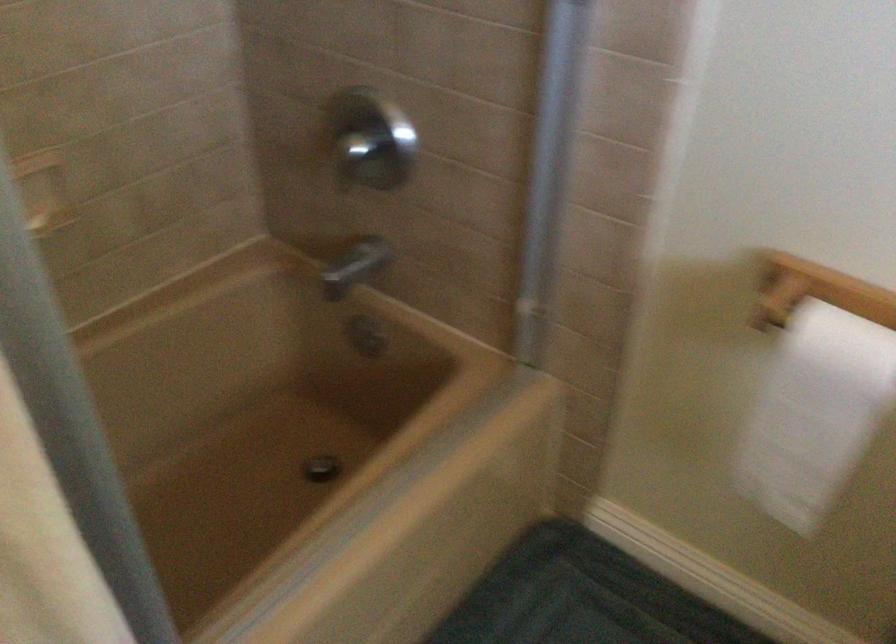
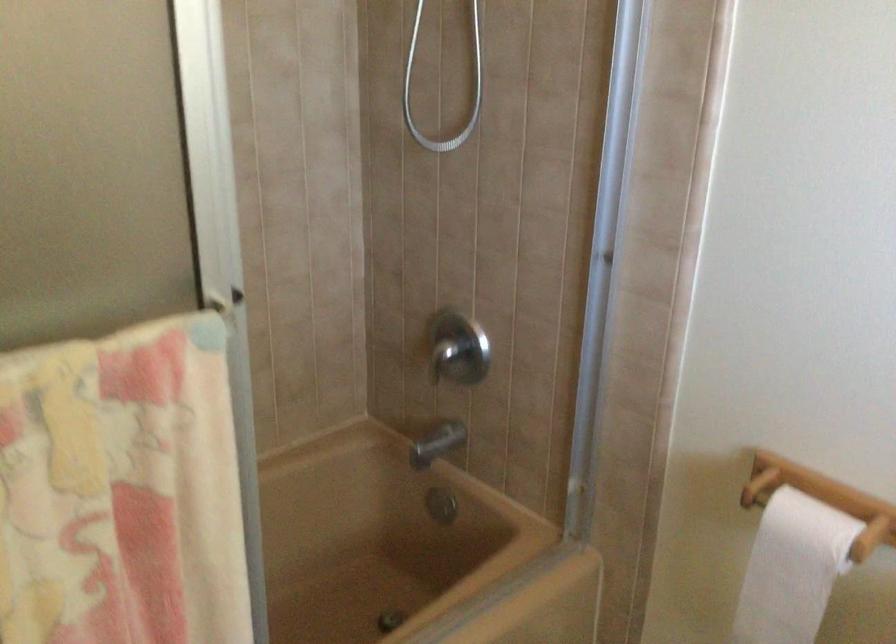
Find the pixel in the second image that matches the point at 351,267 in the first image.

(436, 444)